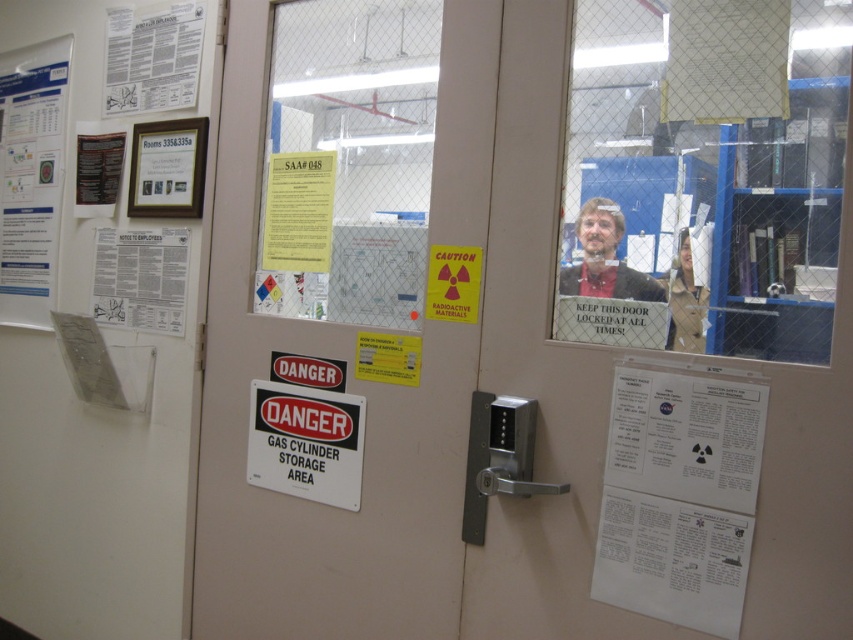
Measure the distance between white paper at upper left and matte black frame at upper left.

white paper at upper left and matte black frame at upper left are 18.76 inches apart from each other.

Between white paper at upper left and matte black frame at upper left, which one has less height?

matte black frame at upper left is shorter.

Does point (36, 234) come closer to viewer compared to point (144, 173)?

No, it is behind (144, 173).

Locate an element on the screen. white paper at upper left is located at coordinates (30, 177).

At what (x,y) coordinates should I click in order to perform the action: click on yellow paper at upper center. Please return your answer as a coordinate pair (x, y). Looking at the image, I should click on (299, 211).

Is yellow paper at upper center wider than tan leather jacket at center?

Yes.

Describe the element at coordinates (299, 211) in the screenshot. I see `yellow paper at upper center` at that location.

Locate an element on the screen. This screenshot has width=853, height=640. yellow paper at upper center is located at coordinates pyautogui.click(x=299, y=211).

Who is more forward, (277,177) or (192,140)?

Point (277,177) is in front.

Locate an element on the screen. yellow paper at upper center is located at coordinates (299, 211).